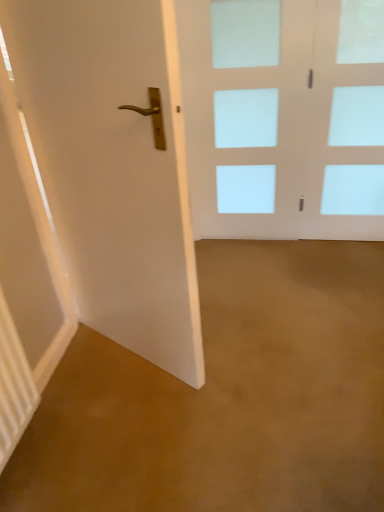
Question: From a real-world perspective, is clear glass door at upper right positioned above or below white glass door at center, the second door positioned from the left?

Choices:
 (A) above
 (B) below

Answer: (B)

Question: Looking at their shapes, would you say clear glass door at upper right is wider or thinner than white glass door at center, which is the 1th door in right-to-left order?

Choices:
 (A) wide
 (B) thin

Answer: (A)

Question: Which is farther from the white glossy door at left, which is the first door from front to back?

Choices:
 (A) clear glass door at upper right
 (B) white glass door at center, marked as the second door in a front-to-back arrangement

Answer: (A)

Question: Which object is the closest to the white glossy door at left, which is the 2th door from right to left?

Choices:
 (A) clear glass door at upper right
 (B) white glass door at center, the second door positioned from the left

Answer: (B)